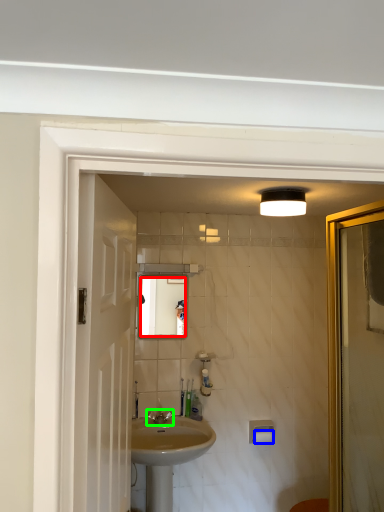
Question: Considering the real-world distances, which object is closest to mirror (highlighted by a red box)? toilet paper (highlighted by a blue box) or tap (highlighted by a green box).

Choices:
 (A) toilet paper
 (B) tap

Answer: (B)